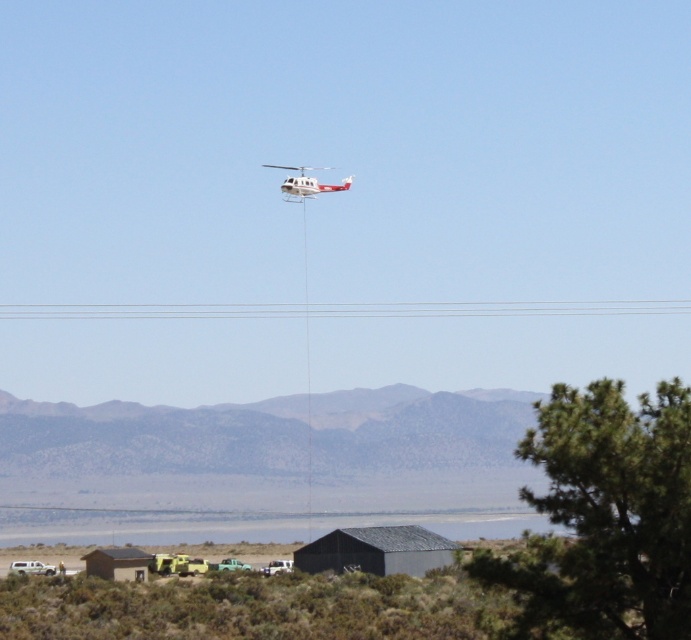
You are a drone operator who needs to fly a drone from the green grass at lower center to the white matte helicopter at upper center. The drone has a maximum flight range of 50 meters. Can the drone reach the helicopter?

The distance between the green grass at lower center and the white matte helicopter at upper center is 49.18 meters, which is within the drone operator s 50 meter range. The drone can reach the helicopter.

Based on the photo, you are a drone operator trying to land your drone safely. You see the green grass at lower center and the white matte helicopter at upper center. Which area is larger and safer for landing your drone?

The green grass at lower center is bigger than the white matte helicopter at upper center, so it is a safer area for landing the drone.

You are standing at the camera position looking at the scene. There are two points marked in the image, point A at coordinates (553, 529) and point B at coordinates (302, 164). Which point is closer to you?

Point A at coordinates (553, 529) is closer to the camera than point B at coordinates (302, 164).